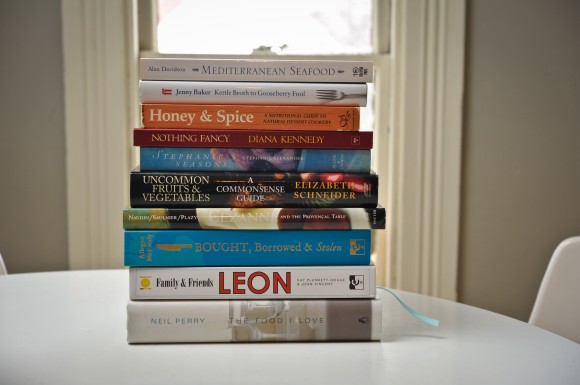
Locate an element on the screen. books is located at coordinates (239, 63), (242, 93), (242, 115), (253, 139), (255, 160), (255, 185), (255, 223), (264, 249), (266, 273), (267, 314).